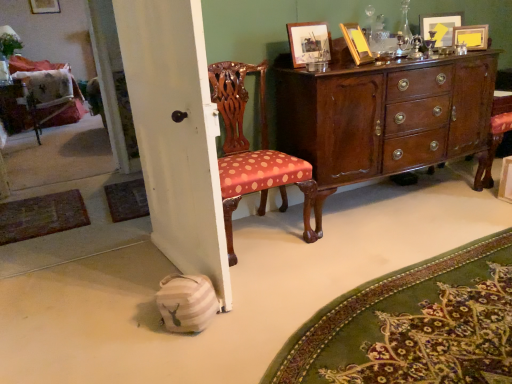
Question: From a real-world perspective, relative to polished wood chair at center, is beige woven mat at lower left, placed as the 1th mat when sorted from right to left, vertically above or below?

Choices:
 (A) above
 (B) below

Answer: (B)

Question: Is point (484, 365) positioned closer to the camera than point (220, 110)?

Choices:
 (A) farther
 (B) closer

Answer: (B)

Question: Estimate the real-world distances between objects in this image. Which object is farther from the woven brown mat at lower left, which is the third mat from front to back?

Choices:
 (A) white painted wood door at lower left
 (B) wooden picture frame at upper left, which is the first picture frame in left-to-right order
 (C) wooden picture frame at upper right, which is the 3th picture frame in left-to-right order
 (D) green felt mat at lower left, the third mat from the right
 (E) polished wood chair at center

Answer: (B)

Question: Which object is positioned closest to the polished dark wood cabinet at center?

Choices:
 (A) beige woven mat at lower left, placed as the 1th mat when sorted from right to left
 (B) green felt mat at lower left, the third mat from the right
 (C) polished wood chair at center
 (D) polka dot fabric swivel chair at left
 (E) white painted wood door at lower left

Answer: (C)